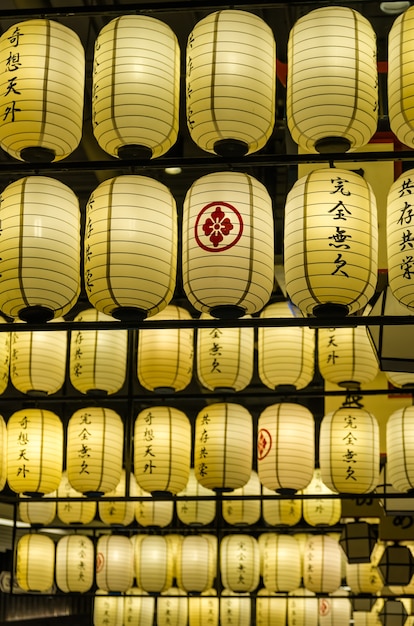
The width and height of the screenshot is (414, 626). In order to click on white circular object that looks like a smoke alarm in this screenshot , I will do `click(387, 8)`.